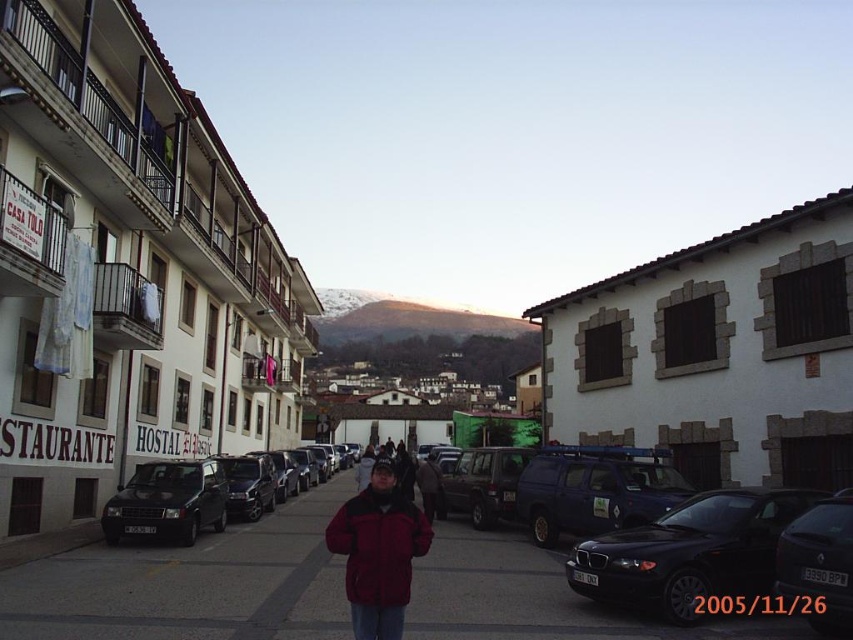
You are standing at the point marked by the coordinates point (x=201, y=476) and want to walk to the point marked by point (x=834, y=616). Which direction should you face to move towards your destination?

Since point (x=201, y=476) is closer to you than point (x=834, y=616), you should face away from yourself to move towards the destination. This means you would need to look in the direction away from your current position towards the point further away.

You are a delivery person standing on the dark gray concrete pavement at center. You need to place a package on the dark red fleece jacket at center. Is the pavement wide enough to do this without stepping onto the jacket?

The dark gray concrete pavement at center might be wider than dark red fleece jacket at center, so there is a possibility that the pavement is wide enough to place the package without stepping on the jacket. However, the exact dimensions are uncertain based on the provided information.